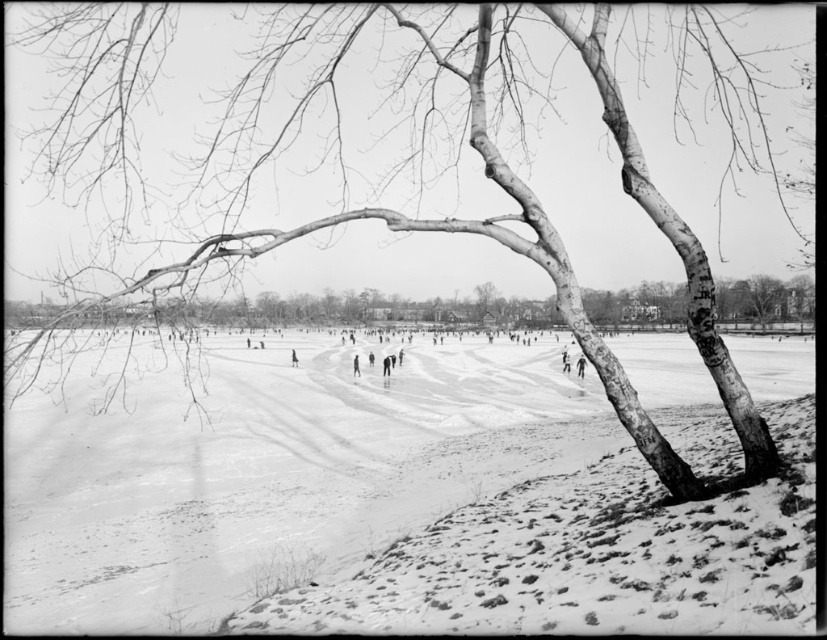
Who is lower down, white powdery snow at center or smooth bark tree at center?

white powdery snow at center

Consider the image. Is white powdery snow at center further to the viewer compared to smooth bark tree at center?

Yes, it is.

Is point (491, 477) positioned before point (786, 320)?

That is True.

The width and height of the screenshot is (827, 640). I want to click on white powdery snow at center, so click(x=270, y=472).

Who is positioned more to the right, smooth bark tree at center or smooth skin person at center?

smooth bark tree at center

Does point (753, 310) come behind point (354, 356)?

Yes.

Locate an element on the screen. The width and height of the screenshot is (827, 640). smooth bark tree at center is located at coordinates (371, 308).

Find the location of a particular element. This screenshot has width=827, height=640. smooth bark tree at center is located at coordinates (371, 308).

Does white powdery snow at center lie in front of smooth skin person at center?

Yes, it is.

The height and width of the screenshot is (640, 827). Describe the element at coordinates (270, 472) in the screenshot. I see `white powdery snow at center` at that location.

This screenshot has width=827, height=640. Find the location of `white powdery snow at center`. white powdery snow at center is located at coordinates (270, 472).